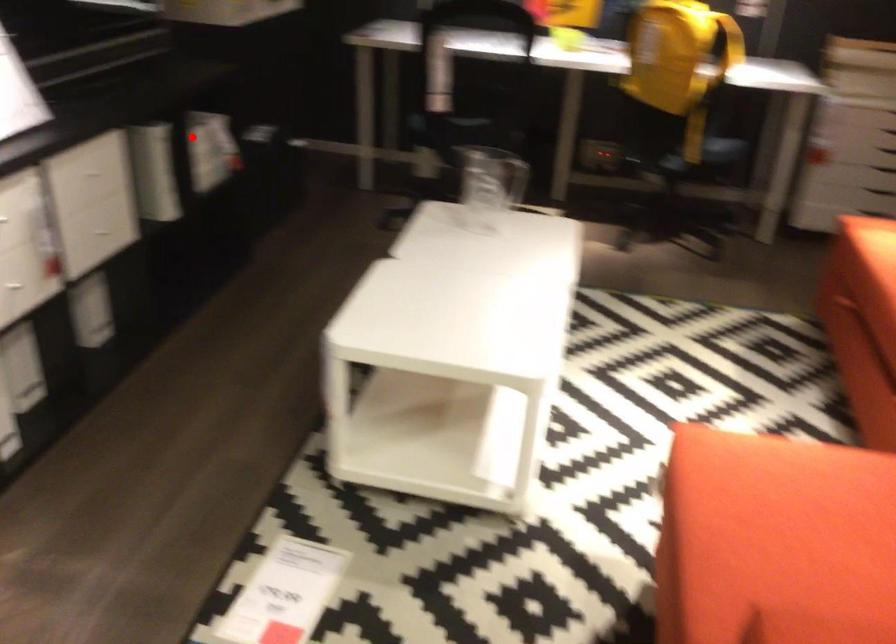
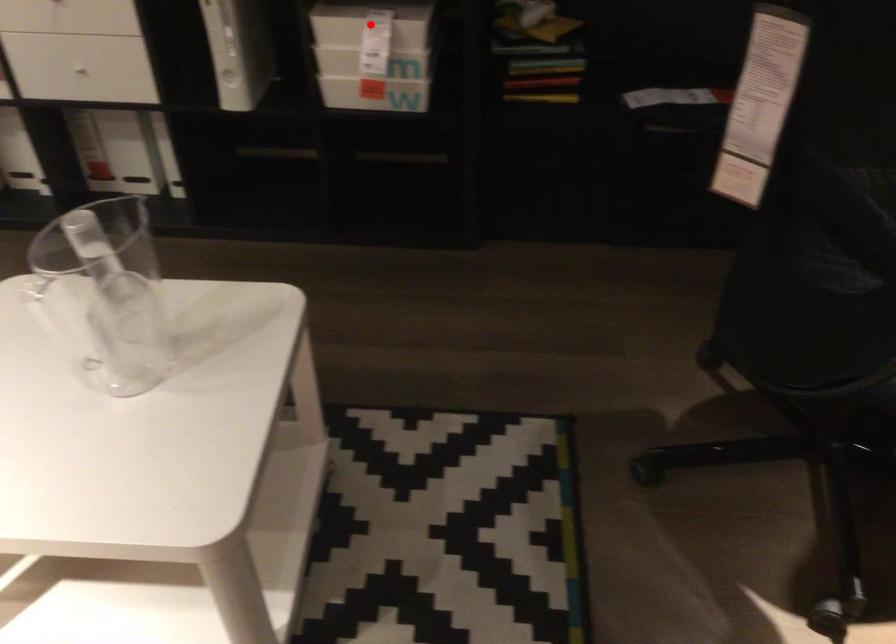
I am providing you with two images of the same scene from different viewpoints. A red point is marked on the first image and another point is marked on the second image. Is the marked point in image1 the same physical position as the marked point in image2?

Yes